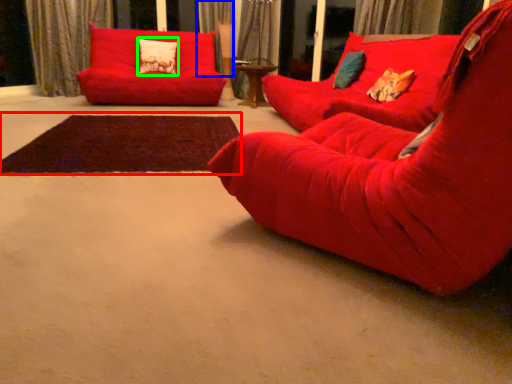
Question: Which object is the farthest from mat (highlighted by a red box)? Choose among these: curtain (highlighted by a blue box) or pillow (highlighted by a green box).

Choices:
 (A) curtain
 (B) pillow

Answer: (A)